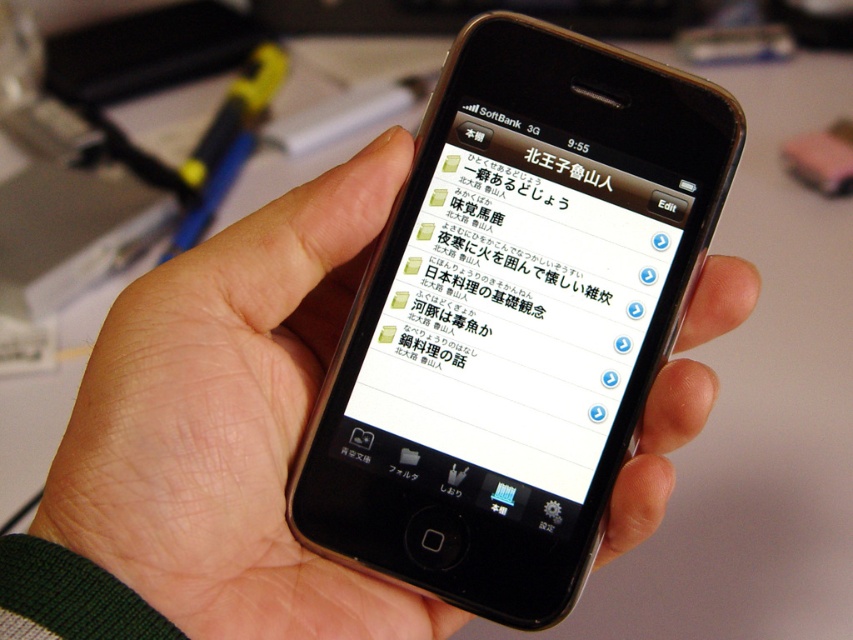
Can you confirm if black matte phone at center is positioned below white glossy text at center?

Yes.

Which of these two, black matte phone at center or white glossy text at center, stands taller?

black matte phone at center

Is point (142, 385) more distant than point (596, 326)?

That is False.

Where is `black matte phone at center`? black matte phone at center is located at coordinates (230, 422).